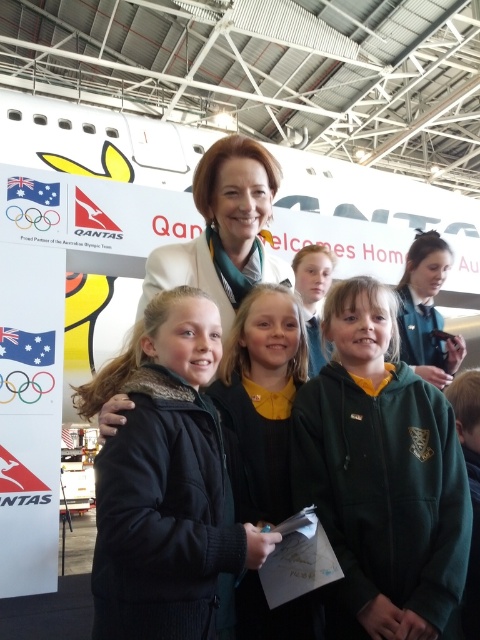
You are a photographer at the event and need to capture a photo of both the black fuzzy jacket at center and the green fabric jacket at upper right. Which jacket should you focus on first to ensure it fits in the frame?

You should focus on the black fuzzy jacket at center first because it is bigger than the green fabric jacket at upper right, so it requires more space in the frame.

You are a photographer at the event and need to position a spotlight on the black woolen sweater at center. The spotlight can only be placed at coordinates point (261, 401). Is this the correct location for the spotlight?

Yes, the point (261, 401) marks the black woolen sweater at center, so placing the spotlight there will correctly illuminate the black woolen sweater at center.

You are organizing a photo shoot and need to arrange two jackets for a backdrop. The black fuzzy jacket at center and the green fleece jacket at lower right are available. If you want to use the wider jacket as the main focus, which one should you choose?

The black fuzzy jacket at center should be chosen as the main focus because its width is larger than the green fleece jacket at lower right.